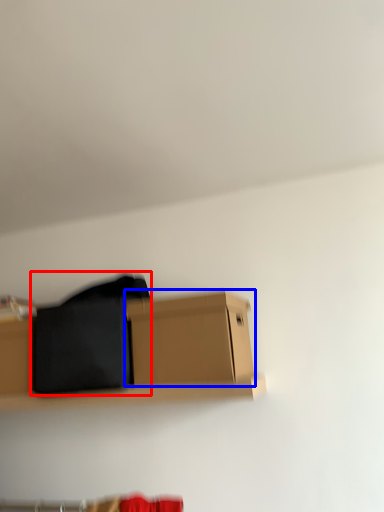
Question: Which object is closer to the camera taking this photo, clothing (highlighted by a red box) or box (highlighted by a blue box)?

Choices:
 (A) clothing
 (B) box

Answer: (B)